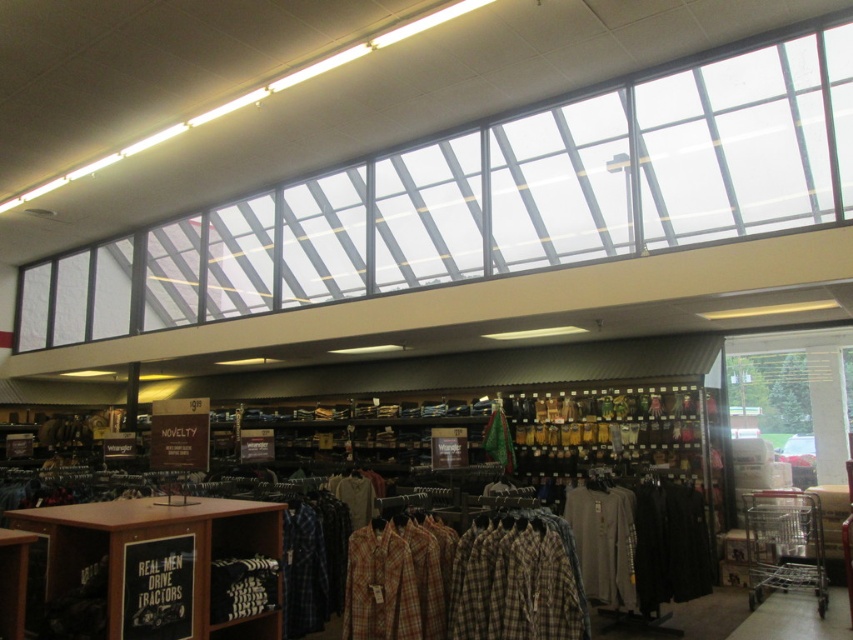
Which of these two, wooden shelf at lower left or plaid cotton shirt at center, stands taller?

wooden shelf at lower left

Based on the photo, is wooden shelf at lower left wider than plaid cotton shirt at center?

Correct, the width of wooden shelf at lower left exceeds that of plaid cotton shirt at center.

Describe the element at coordinates (154, 570) in the screenshot. The height and width of the screenshot is (640, 853). I see `wooden shelf at lower left` at that location.

Locate an element on the screen. Image resolution: width=853 pixels, height=640 pixels. wooden shelf at lower left is located at coordinates (154, 570).

Between wooden shelf at lower left and gray cotton t-shirt at center, which one is positioned lower?

gray cotton t-shirt at center is below.

Between wooden shelf at lower left and gray cotton t-shirt at center, which one appears on the left side from the viewer's perspective?

wooden shelf at lower left

Is point (65, 598) in front of point (608, 486)?

Yes.

At what (x,y) coordinates should I click in order to perform the action: click on wooden shelf at lower left. Please return your answer as a coordinate pair (x, y). This screenshot has width=853, height=640. Looking at the image, I should click on (154, 570).

Can you confirm if plaid cotton shirt at center is taller than gray cotton t-shirt at center?

Incorrect, plaid cotton shirt at center's height is not larger of gray cotton t-shirt at center's.

Does plaid cotton shirt at center appear over gray cotton t-shirt at center?

Correct, plaid cotton shirt at center is located above gray cotton t-shirt at center.

Between point (503, 577) and point (602, 538), which one is positioned in front?

Point (503, 577) is in front.

This screenshot has width=853, height=640. In order to click on plaid cotton shirt at center in this screenshot , I will do [x=515, y=580].